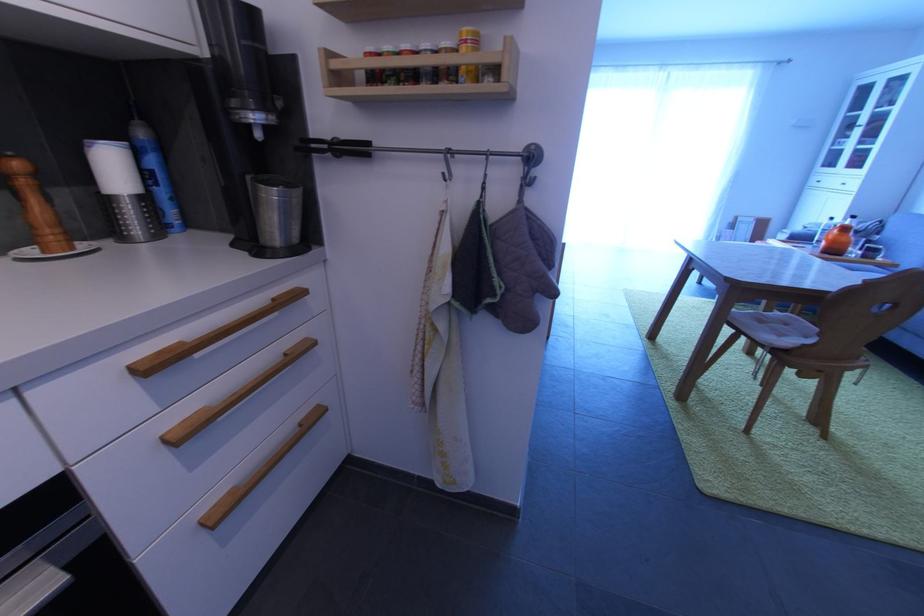
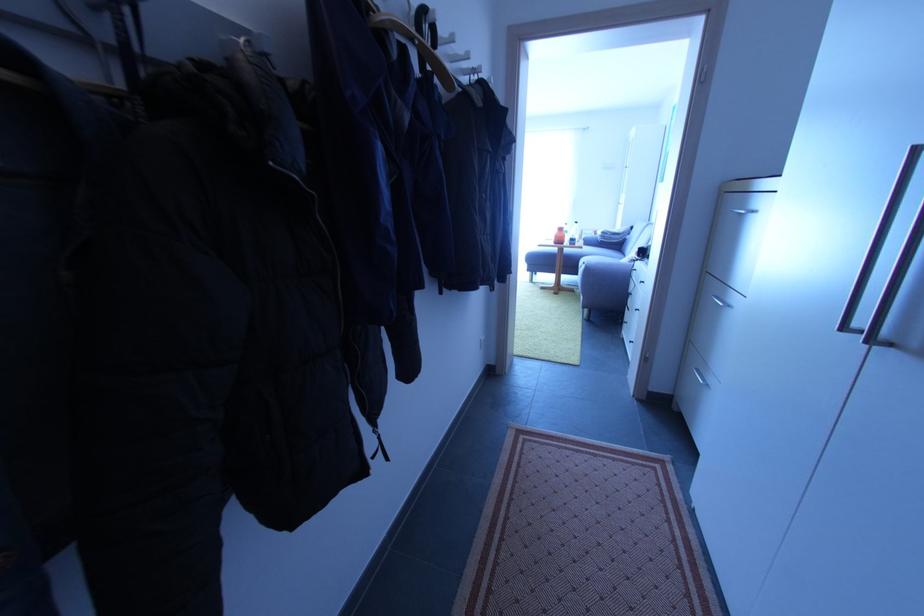
In the second image, find the point that corresponds to point (736, 228) in the first image.

(585, 238)